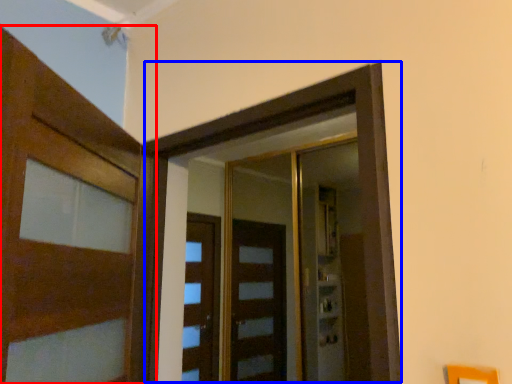
Question: Which object is closer to the camera taking this photo, door (highlighted by a red box) or elevator (highlighted by a blue box)?

Choices:
 (A) door
 (B) elevator

Answer: (A)